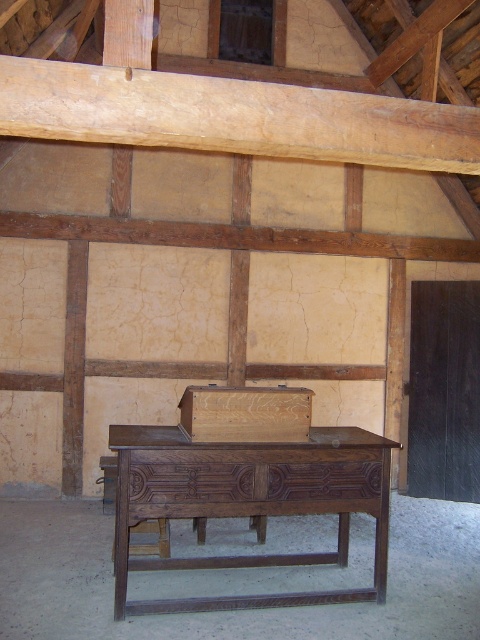
You are an interior designer planning to hang a painting that is 0.2 meters wide. You want to place it at the exact center of the light brown wooden beam at upper center. What is the coordinate where you should position the center of the painting?

The center of the painting should be placed at coordinate point (232, 116), which is the exact center of the light brown wooden beam at upper center.

You are standing in the rustic room and want to place a small object on the table. You have two points marked on the table surface at coordinates point (400, 168) and point (298, 509). Which point is closer to you when looking at the table?

Point (400, 168) is further to the camera than point (298, 509), so the point closer to you would be point (298, 509).

You are an architect inspecting the room. You need to hang a heavy chandelier from the ceiling. The dark wood table at center is directly below the light brown wooden beam at upper center. Will the chandelier be obstructed by the beam when hung?

The light brown wooden beam at upper center is above the dark wood table at center, so the chandelier hung from the beam would be directly above the table. This means the beam itself would not obstruct the chandelier, but the chandelier might hang down towards the table, potentially causing obstruction depending on its length. However, based on the given information, the beam is positioned above the table, so the chandelier could be hung in that location without obstruction from the beam itself.